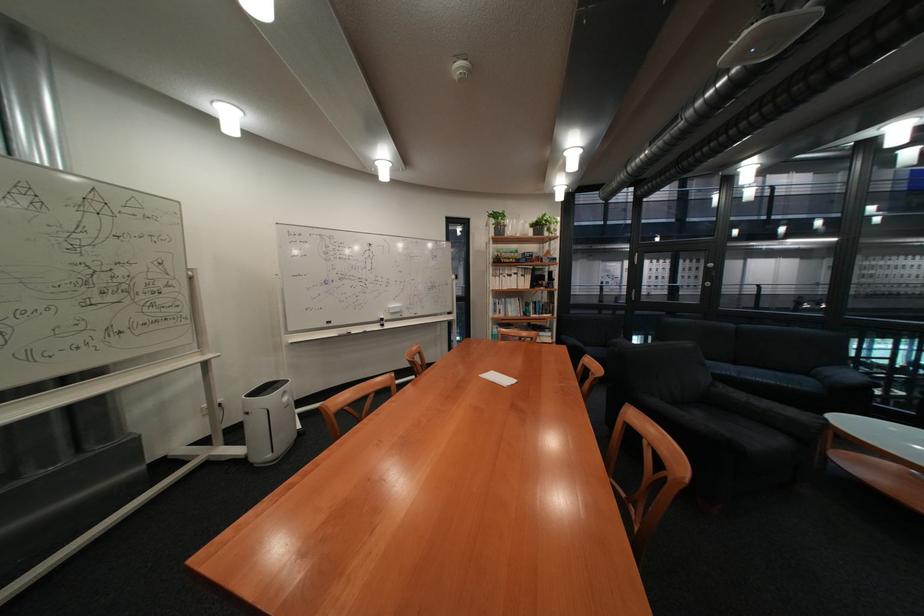
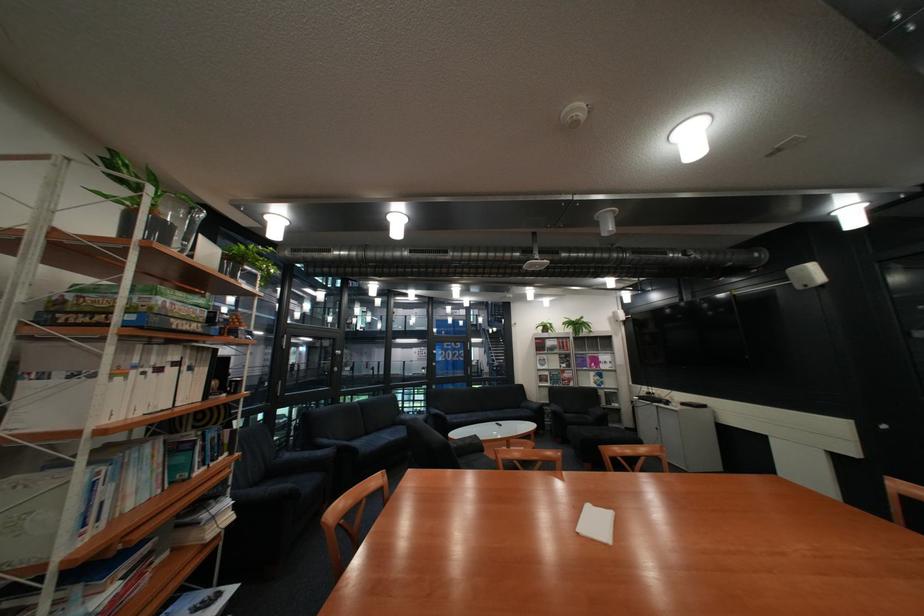
The point at (513, 277) is marked in the first image. Where is the corresponding point in the second image?

(134, 379)